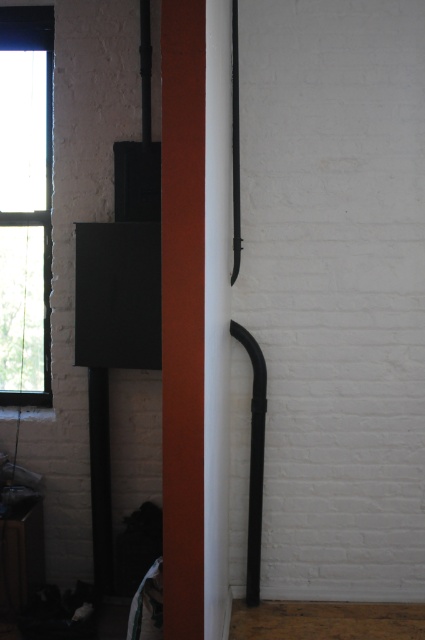
You are standing in the interior space described. If you look towards the left wall, can you see the clear glass window at left? Please explain based on its position.

Yes, the clear glass window at left is located at point (x=25, y=204), which is on the left wall, so you can see it when looking towards the left wall.

You are an interior designer planning to install a new light fixture. You have two options to choose from. One is a pendant light that needs to be hung from the matte wood pillar at center, and the other is a wall sconce that can be mounted on the black matte pipe at center. Based on their positions, which fixture would be more appropriate for each location?

The pendant light should be hung from the matte wood pillar at center since it is located above the black matte pipe at center, making it an ideal spot for hanging fixtures. The wall sconce would be better suited for the black matte pipe at center as it is positioned lower and more accessible for wall mounting.

What object is located at the coordinates point (183, 314) in the image?

The point (183, 314) indicates a matte wood pillar at center.